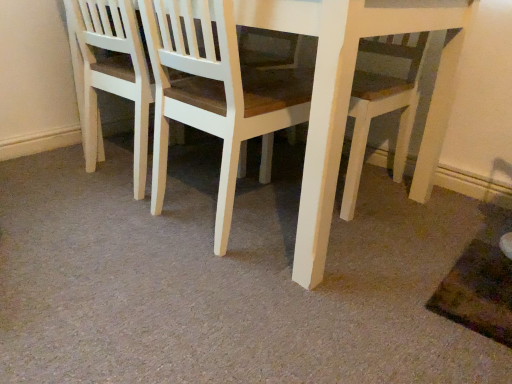
Question: Does point (272, 129) appear closer or farther from the camera than point (110, 36)?

Choices:
 (A) farther
 (B) closer

Answer: (B)

Question: In terms of height, does white wood chair at center, marked as the second chair in a left-to-right arrangement, look taller or shorter compared to white wood chair at center, arranged as the 1th chair when viewed from the left?

Choices:
 (A) tall
 (B) short

Answer: (A)

Question: Is white wood chair at center, acting as the first chair starting from the right, to the left or to the right of white wood chair at center, arranged as the 1th chair when viewed from the left, in the image?

Choices:
 (A) right
 (B) left

Answer: (A)

Question: From a real-world perspective, relative to white wood chair at center, marked as the second chair in a left-to-right arrangement, is white wood chair at center, arranged as the 1th chair when viewed from the left, vertically above or below?

Choices:
 (A) above
 (B) below

Answer: (B)

Question: Is white wood chair at center, the 2th chair in the right-to-left sequence, situated inside white wood chair at center, acting as the first chair starting from the right, or outside?

Choices:
 (A) inside
 (B) outside

Answer: (B)

Question: Considering the positions of white wood chair at center, the 2th chair in the right-to-left sequence, and white wood chair at center, acting as the first chair starting from the right, in the image, is white wood chair at center, the 2th chair in the right-to-left sequence, taller or shorter than white wood chair at center, acting as the first chair starting from the right,?

Choices:
 (A) short
 (B) tall

Answer: (A)

Question: From the image's perspective, relative to white wood chair at center, acting as the first chair starting from the right, is white wood chair at center, arranged as the 1th chair when viewed from the left, above or below?

Choices:
 (A) below
 (B) above

Answer: (B)